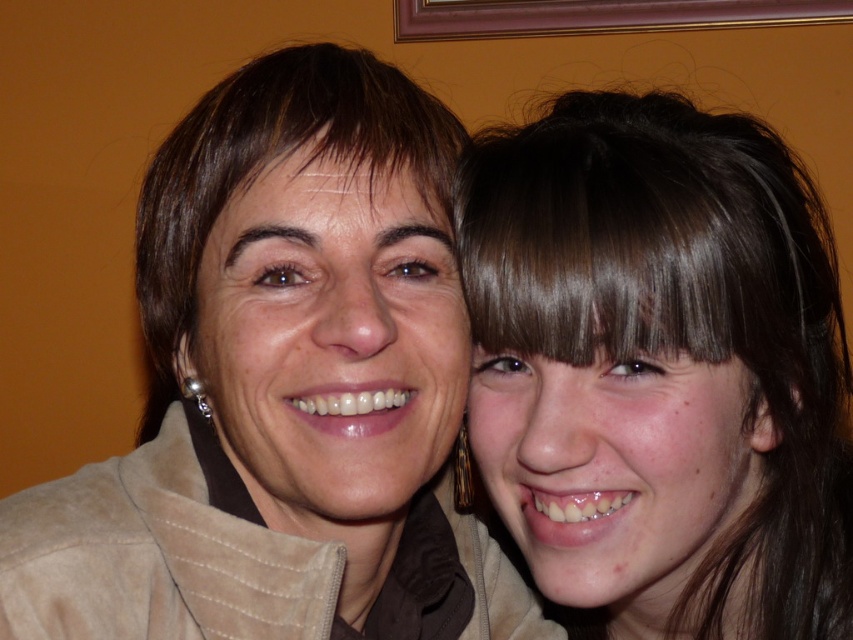
Question: Does suede jacket at center appear on the right side of brown hair at right?

Choices:
 (A) no
 (B) yes

Answer: (A)

Question: Which object appears closest to the camera in this image?

Choices:
 (A) brown hair at right
 (B) suede jacket at center

Answer: (B)

Question: Does suede jacket at center appear over brown hair at right?

Choices:
 (A) yes
 (B) no

Answer: (A)

Question: In this image, where is suede jacket at center located relative to brown hair at right?

Choices:
 (A) right
 (B) left

Answer: (B)

Question: Which point appears farthest from the camera in this image?

Choices:
 (A) (144, 188)
 (B) (780, 392)

Answer: (A)

Question: Which of the following is the farthest from the observer?

Choices:
 (A) (706, 428)
 (B) (184, 531)

Answer: (A)